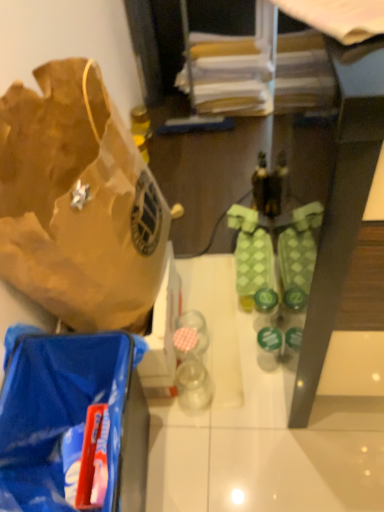
Find the location of `free space above green textured socks at center (from a real-world perspective)`. free space above green textured socks at center (from a real-world perspective) is located at coordinates (254, 253).